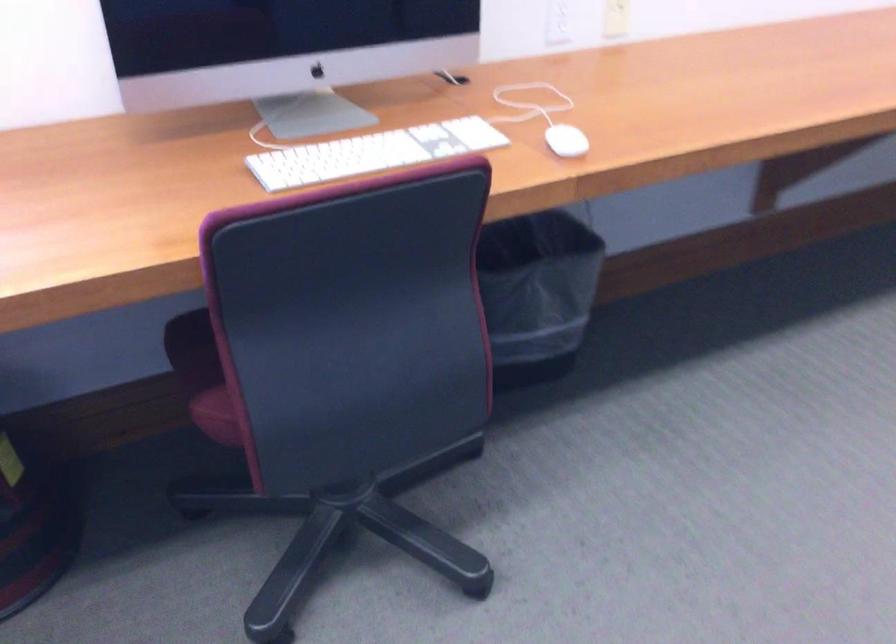
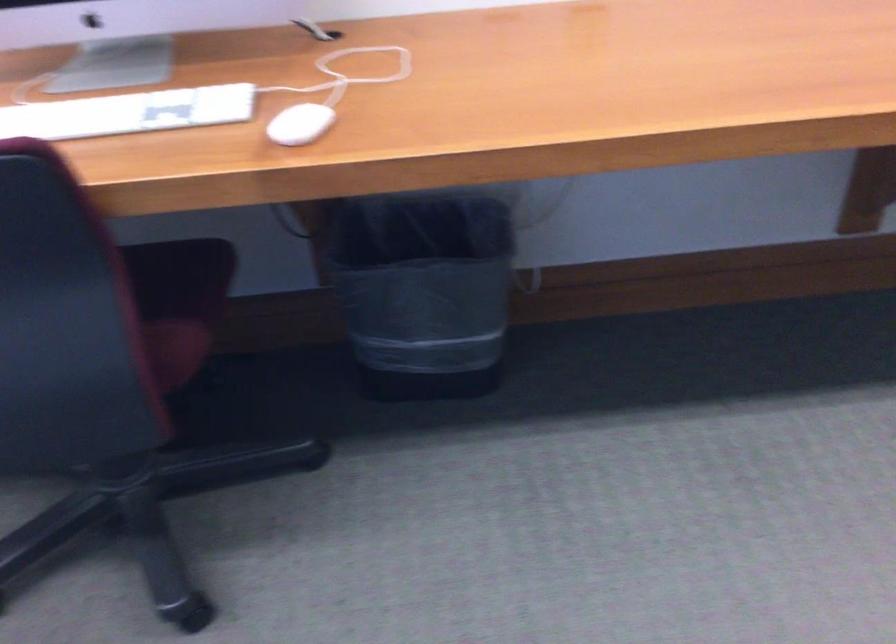
Question: The camera is either moving clockwise (left) or counter-clockwise (right) around the object. The first image is from the beginning of the video and the second image is from the end. Is the camera moving left or right when shooting the video?

Choices:
 (A) Left
 (B) Right

Answer: (B)